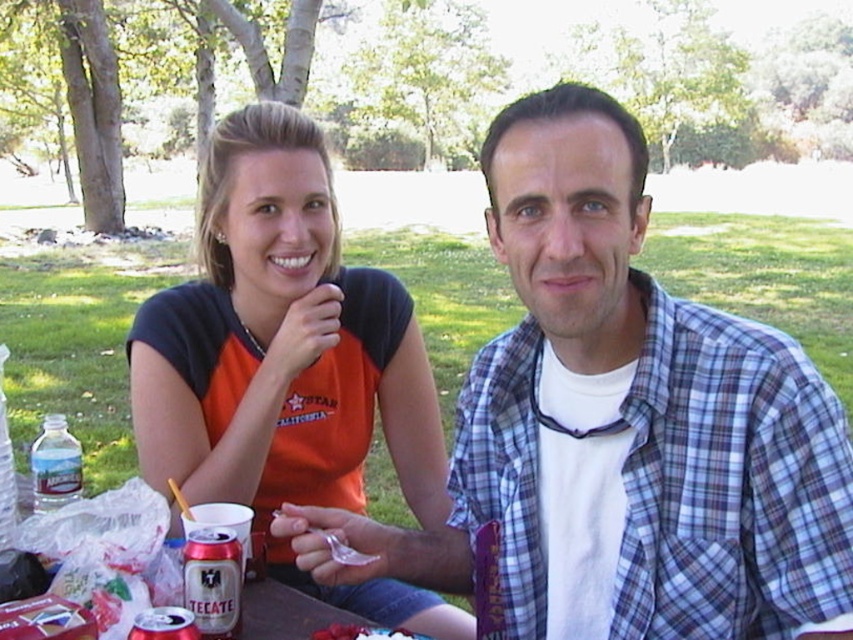
You are a photographer trying to capture a candid shot of the two people at the picnic. You want to ensure both the plaid cotton shirt at center and the orange fabric shirt at upper left are clearly visible in the frame. Based on their positions, which shirt should you focus on first to ensure both are in focus?

The plaid cotton shirt at center is below the orange fabric shirt at upper left, so focusing on the orange fabric shirt at upper left first would help ensure both are in focus since it is higher up and the plaid cotton shirt at center is positioned lower.

You are planning to take a photo of the orange fabric shirt at upper left and the silver metallic can at lower left. Which object should you focus on first if you want to capture both in the frame without moving the camera?

The orange fabric shirt at upper left should be focused on first because it is larger than the silver metallic can at lower left, so ensuring it fits properly will help both objects be in the frame.

You are a photographer trying to capture a closeup of the plaid cotton shirt at center and the orange fabric shirt at upper left. Based on their positions, which shirt should you focus on first to ensure both are in frame?

The plaid cotton shirt at center is in front of the orange fabric shirt at upper left, so you should focus on the plaid cotton shirt at center first to ensure it doesn not block the orange fabric shirt at upper left and both are in frame.